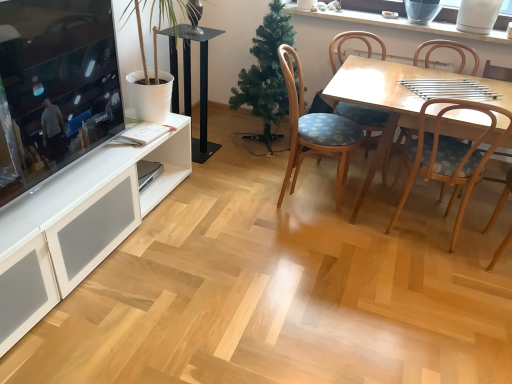
Identify the location of unoccupied area in front of blue fabric chair at center, which appears as the 4th chair when viewed from the right. The height and width of the screenshot is (384, 512). (309, 236).